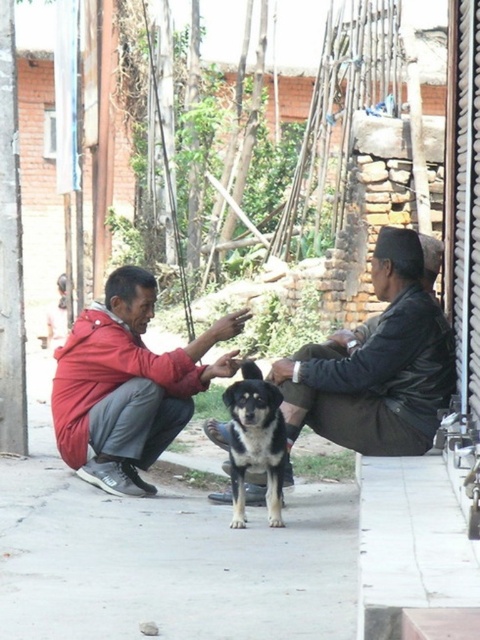
Question: Can you confirm if leather jacket at center is positioned below red matte jacket at center?

Choices:
 (A) no
 (B) yes

Answer: (A)

Question: Which object appears farthest from the camera in this image?

Choices:
 (A) leather jacket at center
 (B) gray concrete pavement at center

Answer: (A)

Question: Which point appears closest to the camera in this image?

Choices:
 (A) (144, 378)
 (B) (126, 580)
 (C) (240, 500)
 (D) (399, 392)

Answer: (B)

Question: Estimate the real-world distances between objects in this image. Which object is closer to the red matte jacket at center?

Choices:
 (A) leather jacket at center
 (B) black and brown fur dog at center

Answer: (B)

Question: Can you confirm if red matte jacket at center is positioned below black and brown fur dog at center?

Choices:
 (A) yes
 (B) no

Answer: (B)

Question: Can you confirm if leather jacket at center is positioned to the right of black and brown fur dog at center?

Choices:
 (A) yes
 (B) no

Answer: (A)